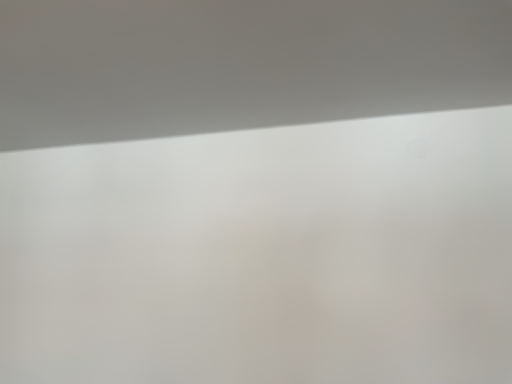
Consider the image. Measure the distance between white matte wall at upper left and camera.

The depth of white matte wall at upper left is 33.62 inches.

The height and width of the screenshot is (384, 512). Describe the element at coordinates (240, 64) in the screenshot. I see `white matte wall at upper left` at that location.

Locate an element on the screen. This screenshot has width=512, height=384. white matte wall at upper left is located at coordinates (240, 64).

Identify the location of white matte wall at upper left. The height and width of the screenshot is (384, 512). (240, 64).